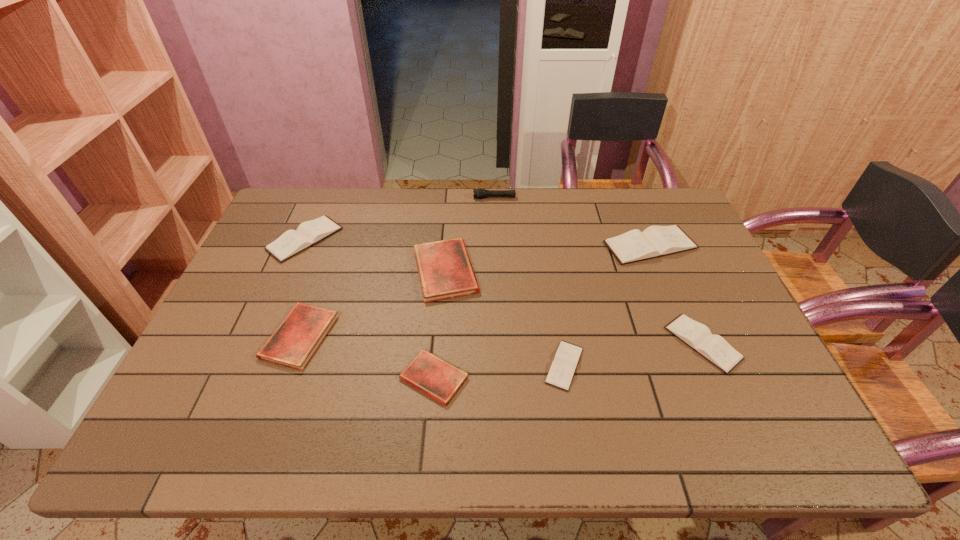
The height and width of the screenshot is (540, 960). I want to click on flashlight, so click(479, 193).

Locate an element on the screen. The width and height of the screenshot is (960, 540). the biggest brown diary is located at coordinates (655, 241).

You are a GUI agent. You are given a task and a screenshot of the screen. Output one action in this format:
    pyautogui.click(x=<x>, y=<y>)
    Task: Click on the second biggest brown diary
    This screenshot has height=540, width=960.
    Given the screenshot: What is the action you would take?
    pyautogui.click(x=292, y=242)

This screenshot has width=960, height=540. Identify the location of the biggest red diary. (445, 271).

The image size is (960, 540). What are the coordinates of `the second smallest brown diary` in the screenshot? It's located at (714, 348).

Locate an element on the screen. the second smallest red diary is located at coordinates (294, 342).

The width and height of the screenshot is (960, 540). I want to click on the fifth diary from left to right, so click(x=563, y=367).

Find the location of a particular element. the second brown diary from left to right is located at coordinates (563, 367).

Identify the location of the smallest red diary. (430, 374).

Find the location of a particular element. free space located 0.290m at the lens end of the flashlight is located at coordinates (392, 198).